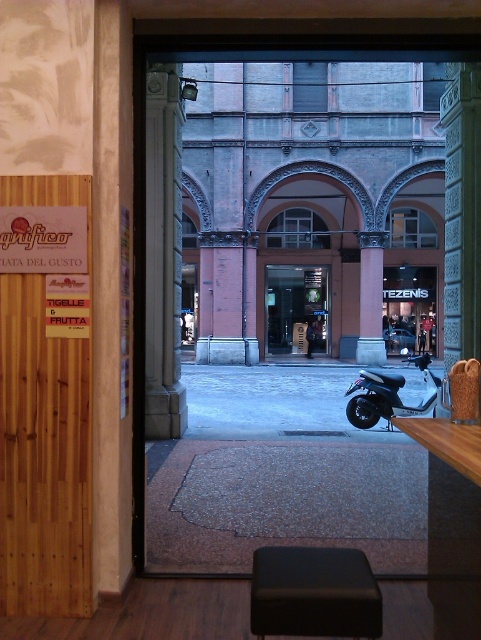
Between wooden sign at left and shiny black scooter at lower right, which one is positioned lower?

shiny black scooter at lower right

Can you confirm if wooden sign at left is bigger than shiny black scooter at lower right?

Actually, wooden sign at left might be smaller than shiny black scooter at lower right.

The image size is (481, 640). Identify the location of wooden sign at left. (42, 460).

Between shiny black scooter at lower right and brown stone pillar at center, which one appears on the right side from the viewer's perspective?

shiny black scooter at lower right is more to the right.

Does shiny black scooter at lower right appear on the right side of brown stone pillar at center?

Yes, shiny black scooter at lower right is to the right of brown stone pillar at center.

Measure the distance between shiny black scooter at lower right and camera.

The distance of shiny black scooter at lower right from camera is 9.76 meters.

Identify the location of shiny black scooter at lower right. Image resolution: width=481 pixels, height=640 pixels. (388, 394).

Can you confirm if black glass door at center is positioned to the right of brown stone pillar at center?

No, black glass door at center is not to the right of brown stone pillar at center.

Does black glass door at center appear over brown stone pillar at center?

Incorrect, black glass door at center is not positioned above brown stone pillar at center.

Does point (295, 282) come behind point (367, 260)?

Yes, point (295, 282) is farther from viewer.

I want to click on black glass door at center, so click(296, 308).